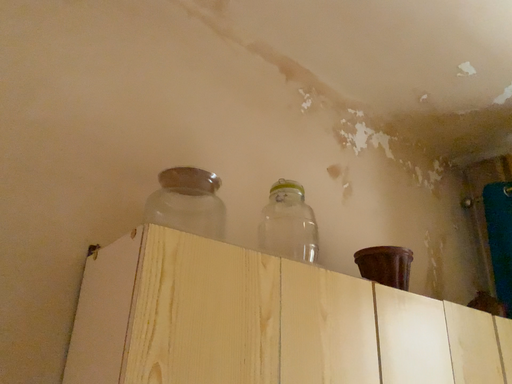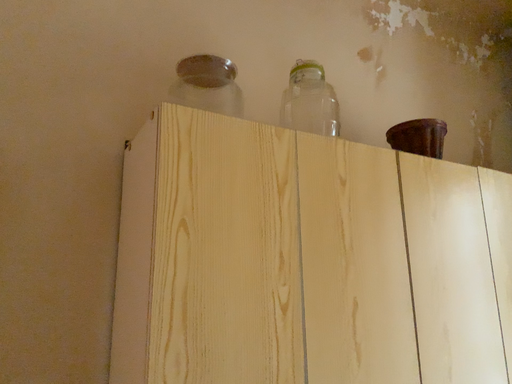
Question: Which way did the camera rotate in the video?

Choices:
 (A) rotated right
 (B) rotated left

Answer: (B)